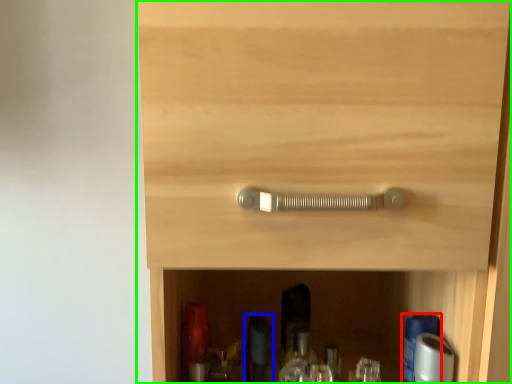
Question: Estimate the real-world distances between objects in this image. Which object is farther from bottle (highlighted by a red box), bottle (highlighted by a blue box) or cupboard (highlighted by a green box)?

Choices:
 (A) bottle
 (B) cupboard

Answer: (B)